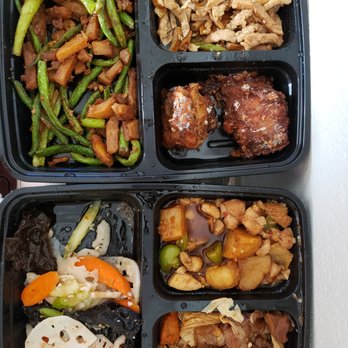
Image resolution: width=348 pixels, height=348 pixels. In order to click on food dishes in this screenshot , I will do `click(237, 240)`, `click(218, 334)`, `click(85, 304)`, `click(84, 53)`, `click(198, 23)`, `click(256, 108)`.